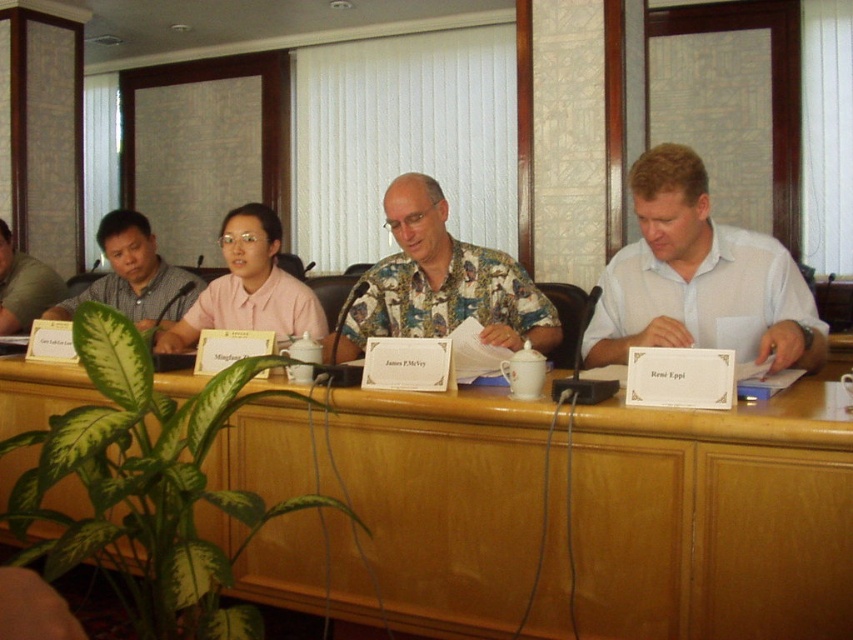
Question: Is wooden table at center in front of floral shirt at center?

Choices:
 (A) no
 (B) yes

Answer: (B)

Question: Considering the relative positions of wooden table at center and brushed metal mug at left in the image provided, where is wooden table at center located with respect to brushed metal mug at left?

Choices:
 (A) above
 (B) below

Answer: (B)

Question: Which object is closer to the camera taking this photo?

Choices:
 (A) pink fabric shirt at center
 (B) brushed metal mug at left
 (C) white cotton shirt at right

Answer: (C)

Question: Does pink fabric shirt at center have a larger size compared to brushed metal mug at left?

Choices:
 (A) yes
 (B) no

Answer: (A)

Question: Among these points, which one is nearest to the camera?

Choices:
 (A) (200, 278)
 (B) (186, 312)
 (C) (32, 276)
 (D) (496, 305)

Answer: (D)

Question: Which of the following is the farthest from the observer?

Choices:
 (A) (15, 252)
 (B) (699, 260)

Answer: (A)